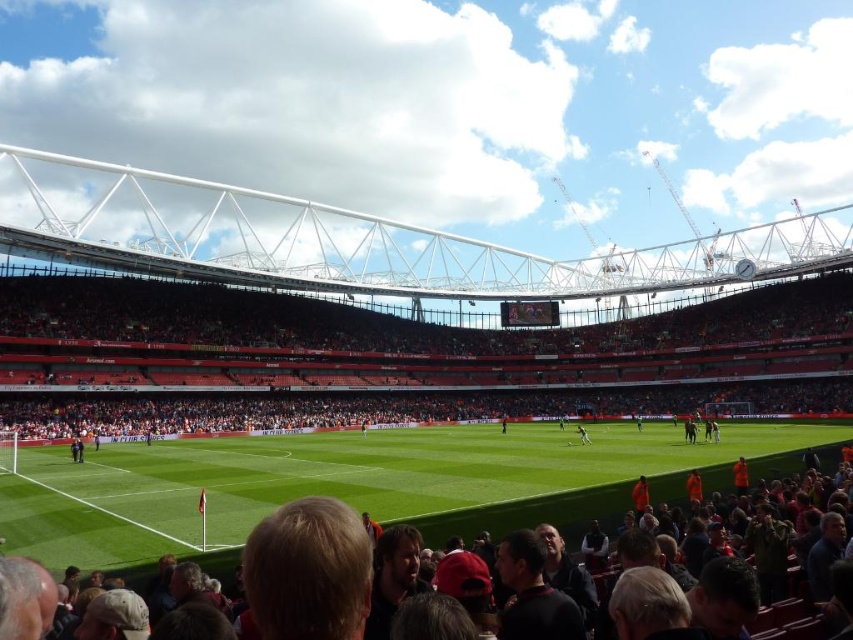
Question: Which of these objects is positioned farthest from the green grass football field at center?

Choices:
 (A) red plastic seats at center
 (B) green grass at center

Answer: (B)

Question: Based on their relative distances, which object is nearer to the green grass at center?

Choices:
 (A) green grass football field at center
 (B) red plastic seats at center

Answer: (A)

Question: Which of these objects is positioned farthest from the green grass football field at center?

Choices:
 (A) green grass at center
 (B) red plastic seats at center

Answer: (A)

Question: Does red plastic seats at center have a lesser width compared to green grass football field at center?

Choices:
 (A) no
 (B) yes

Answer: (A)

Question: Is the position of red plastic seats at center more distant than that of green grass at center?

Choices:
 (A) no
 (B) yes

Answer: (A)

Question: Where is red plastic seats at center located in relation to green grass football field at center in the image?

Choices:
 (A) below
 (B) above

Answer: (B)